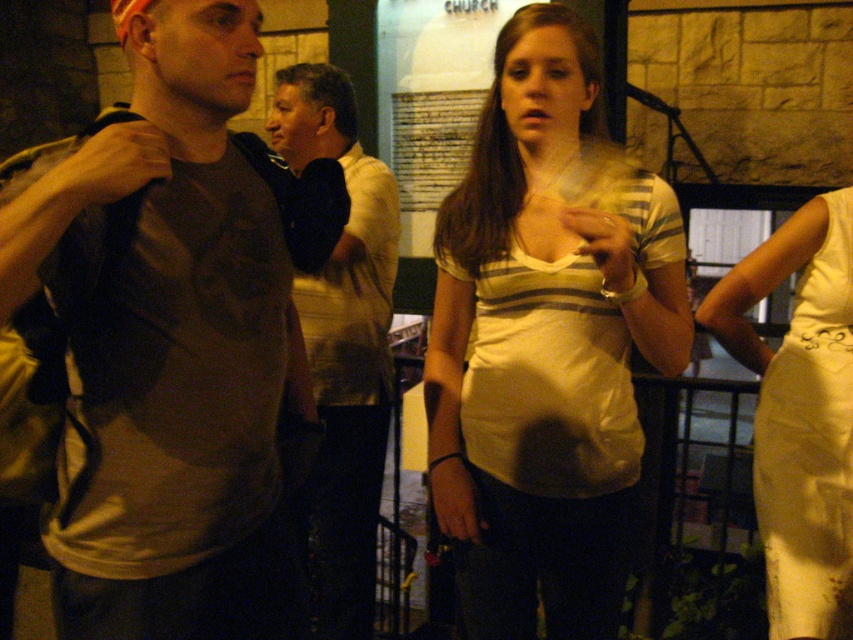
In the scene shown: You are standing in the church and want to hand a note to the person wearing the matte striped shirt at center without disturbing the person in the light brown shirt at center. Which direction should you approach from?

Approach from the front since the matte striped shirt at center is closer to the viewer than the light brown shirt at center, meaning the matte striped shirt at center is in front of the light brown shirt at center.

You are organizing a clothing donation drive and need to categorize items by size. You have two shirts in front of you from the image described. The first is the matte striped shirt at center and the second is the light brown shirt at center. Which shirt should you place in the large size bin?

The matte striped shirt at center is bigger than the light brown shirt at center, so you should place the matte striped shirt at center in the large size bin.

You are standing in the scene and want to move from the point at coordinates point (817, 464) to the point at coordinates point (339, 337). Which direction should you face to walk towards the second point?

You should face downward because point (817, 464) is closer to the viewer than point (339, 337), so the second point is located further away from your current position.